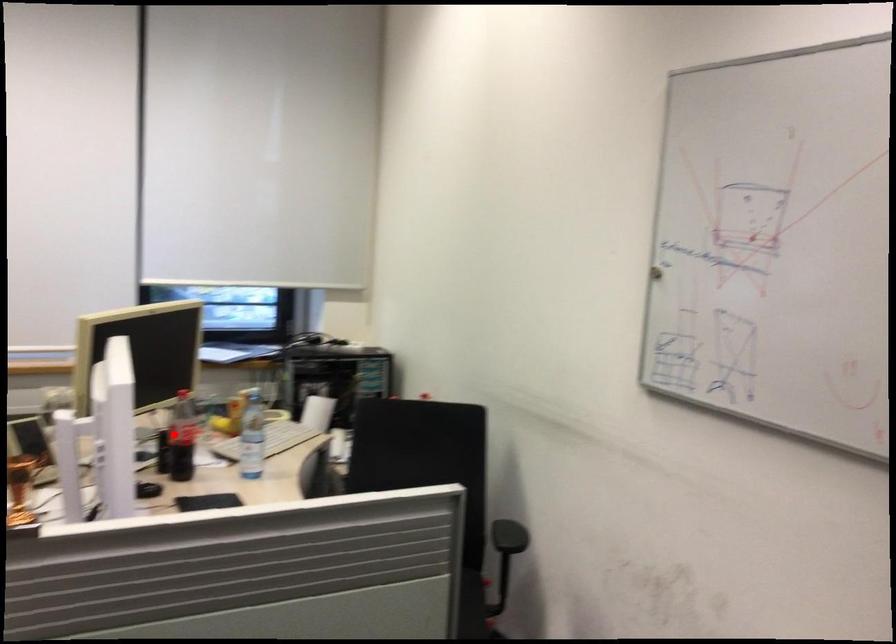
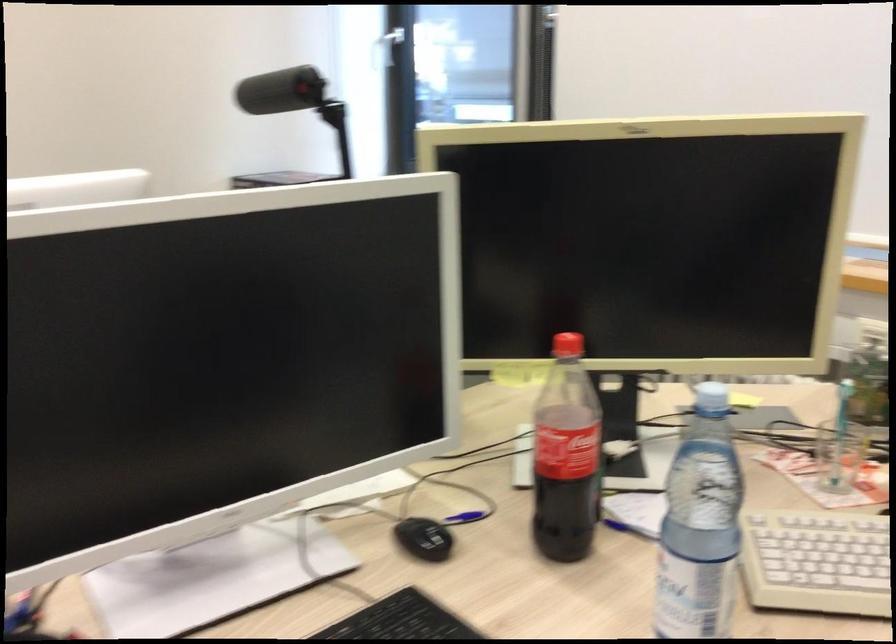
Question: I am providing you with two images of the same scene from different viewpoints. In image1, a red point is highlighted. Considering the same 3D point in image2, which of the following is correct?

Choices:
 (A) It is closer
 (B) It is farther

Answer: (A)